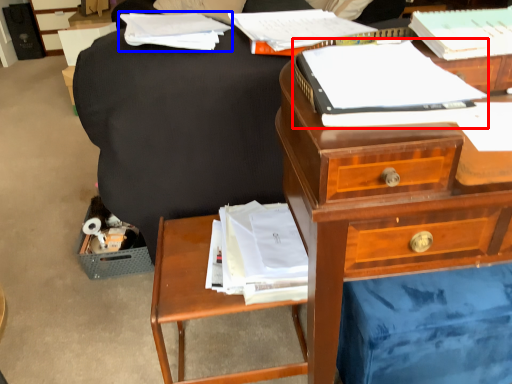
Question: Which point is further to the camera, paperback book (highlighted by a red box) or book (highlighted by a blue box)?

Choices:
 (A) paperback book
 (B) book

Answer: (B)